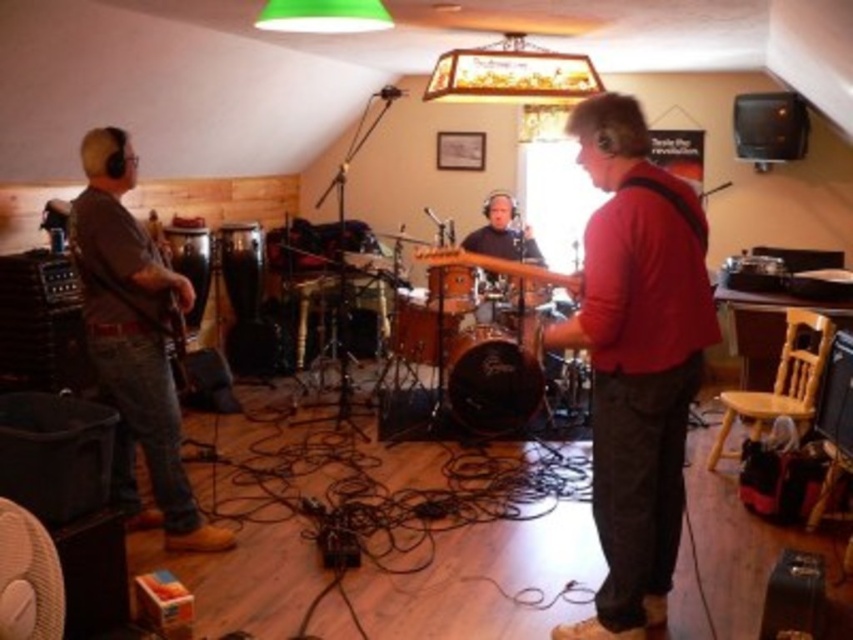
Measure the distance from brown denim jeans at left to wooden drum at center.

brown denim jeans at left and wooden drum at center are 4.40 feet apart from each other.

From the picture: Who is more distant from viewer, (160, 365) or (457, 250)?

Point (160, 365)

At what (x,y) coordinates should I click in order to perform the action: click on brown denim jeans at left. Please return your answer as a coordinate pair (x, y). This screenshot has width=853, height=640. Looking at the image, I should click on (134, 340).

Locate an element on the screen. The image size is (853, 640). brown denim jeans at left is located at coordinates (134, 340).

Who is more distant from viewer, (630, 627) or (3, 538)?

The point (630, 627) is more distant.

Find the location of a particular element. Image resolution: width=853 pixels, height=640 pixels. red matte guitar at center is located at coordinates (636, 358).

The image size is (853, 640). In order to click on red matte guitar at center in this screenshot , I will do `click(636, 358)`.

Which is below, brown denim jeans at left or white fabric fan at lower left?

white fabric fan at lower left is lower down.

Does brown denim jeans at left have a lesser height compared to white fabric fan at lower left?

Incorrect, brown denim jeans at left's height does not fall short of white fabric fan at lower left's.

Does point (131, 504) lie behind point (33, 577)?

Yes, point (131, 504) is farther from viewer.

The image size is (853, 640). Find the location of `brown denim jeans at left`. brown denim jeans at left is located at coordinates (134, 340).